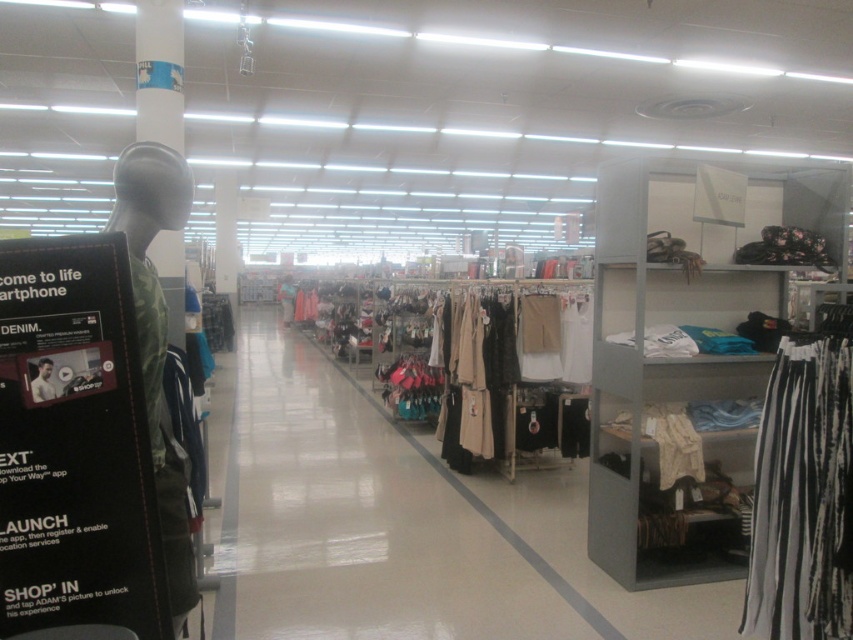
You are a customer in the store and want to try on the white fabric clothing at center. You are currently standing at point [370,520]. Is the clothing within your reach?

The white fabric clothing at center is located at point [370,520], so yes, the clothing is exactly at your current position, making it easily reachable.

Consider the image. You are a store employee who needs to access the matte beige dress at center displayed above the white fabric clothing at center. What is the first step you should take to reach it?

The matte beige dress at center is located above the white fabric clothing at center, so you should first move the white fabric clothing at center out of the way to access the dress.

Based on the photo, you are a store employee who needs to retrieve a black striped skirt at lower right for a customer. The store has a policy that requires you to walk only on the polished concrete floor to avoid damaging the carpeted areas. Given that your current position is at point (804,497), can you directly walk to the black striped skirt at lower right without stepping on any carpet?

Yes, since both your current position at point (804,497) and the black striped skirt at lower right are on the polished concrete floor, you can walk directly to it without stepping on any carpeted areas.